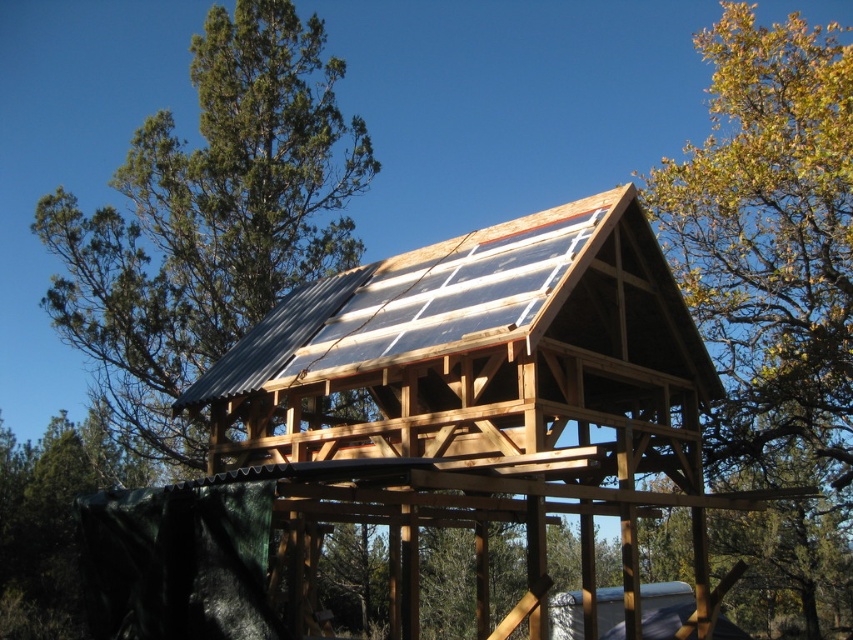
Does point (531, 355) come farther from viewer compared to point (730, 32)?

No, it is not.

Can you confirm if metallic silver solar panel at center is wider than green leafy tree at upper right?

No.

Find the location of a particular element. The image size is (853, 640). metallic silver solar panel at center is located at coordinates (480, 401).

Which is behind, point (222, 410) or point (143, 301)?

The point (143, 301) is more distant.

Is metallic silver solar panel at center to the left of green leafy tree at upper left from the viewer's perspective?

In fact, metallic silver solar panel at center is to the right of green leafy tree at upper left.

Measure the distance between point (625, 609) and camera.

Point (625, 609) and camera are 35.28 feet apart.

I want to click on metallic silver solar panel at center, so click(x=480, y=401).

Is green leafy tree at upper right to the right of green leafy tree at upper left from the viewer's perspective?

Yes, green leafy tree at upper right is to the right of green leafy tree at upper left.

Is green leafy tree at upper right smaller than green leafy tree at upper left?

Actually, green leafy tree at upper right might be larger than green leafy tree at upper left.

Image resolution: width=853 pixels, height=640 pixels. I want to click on green leafy tree at upper right, so click(773, 291).